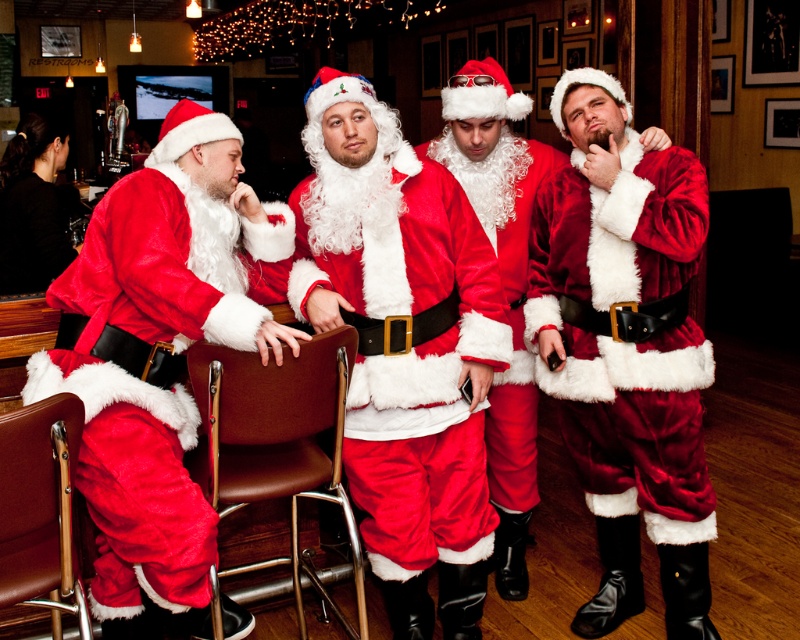
Question: Which object is the farthest from the velvet santa claus at right?

Choices:
 (A) fuzzy red santa suit at left
 (B) fuzzy red santa suit at center

Answer: (A)

Question: Which of the following is the closest to the observer?

Choices:
 (A) fuzzy red santa suit at left
 (B) velvet santa suit at center
 (C) fuzzy red santa suit at center
 (D) velvet santa claus at right

Answer: (A)

Question: Does fuzzy red santa suit at left come behind velvet santa claus at right?

Choices:
 (A) no
 (B) yes

Answer: (A)

Question: Is fuzzy red santa suit at left to the left of velvet santa claus at right from the viewer's perspective?

Choices:
 (A) no
 (B) yes

Answer: (B)

Question: Which point is farther to the camera?

Choices:
 (A) (644, 515)
 (B) (366, 228)

Answer: (A)

Question: In this image, where is velvet santa claus at right located relative to velvet santa suit at center?

Choices:
 (A) above
 (B) below

Answer: (B)